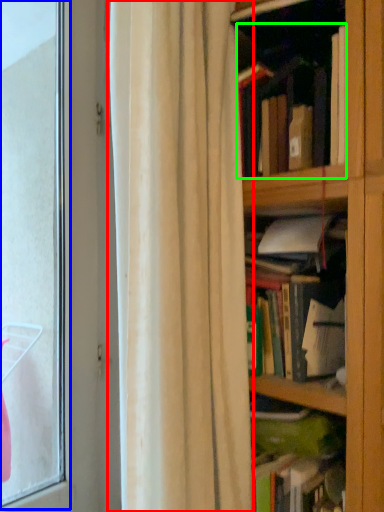
Question: Which object is the farthest from curtain (highlighted by a red box)? Choose among these: bay window (highlighted by a blue box) or book (highlighted by a green box).

Choices:
 (A) bay window
 (B) book

Answer: (A)